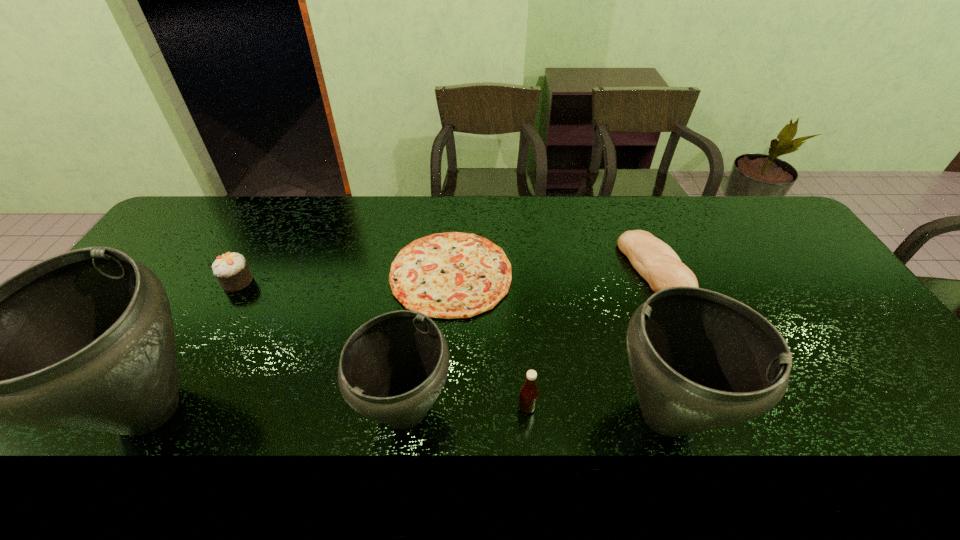
I want to click on the leftmost urn, so 84,340.

I want to click on the tallest object, so pos(84,340).

At what (x,y) coordinates should I click in order to perform the action: click on the second urn from right to left. Please return your answer as a coordinate pair (x, y). The height and width of the screenshot is (540, 960). Looking at the image, I should click on (392, 369).

The height and width of the screenshot is (540, 960). I want to click on the third tallest object, so click(392, 369).

You are a GUI agent. You are given a task and a screenshot of the screen. Output one action in this format:
    pyautogui.click(x=<x>, y=<y>)
    Task: Click on the sixth shortest object
    
    Given the screenshot: What is the action you would take?
    click(700, 360)

Find the location of a particular element. The height and width of the screenshot is (540, 960). the second tallest urn is located at coordinates (700, 360).

Find the location of `cupcake`. cupcake is located at coordinates (232, 271).

Image resolution: width=960 pixels, height=540 pixels. I want to click on the second shortest object, so click(655, 261).

At what (x,y) coordinates should I click in order to perform the action: click on the shortest object. Please return your answer as a coordinate pair (x, y). The image size is (960, 540). Looking at the image, I should click on (452, 275).

The image size is (960, 540). Find the location of `the fourth shortest object`. the fourth shortest object is located at coordinates (528, 397).